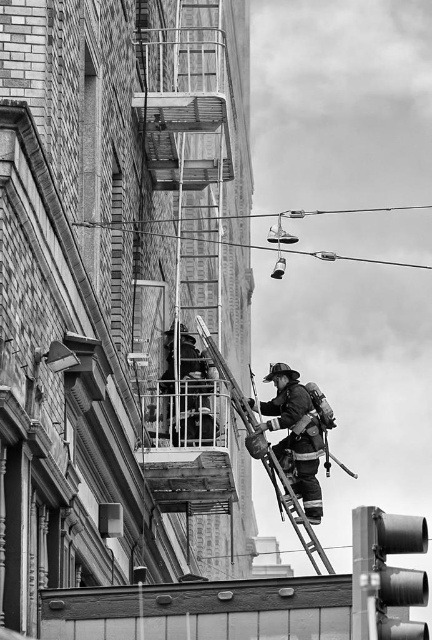
From the picture: You are a firefighter trying to reach the third floor window of the building. You have two options to climb up, the rustic metal fire escape at center and the metallic silver ladder at center. Which one would you choose and why?

You should choose the rustic metal fire escape at center because it is larger in size than the metallic silver ladder at center, making it more stable and safer for climbing to the third floor window.

You are standing at the base of the building and want to reach the point marked as point (380, 541). If your ladder can extend up to 50 meters, will it be sufficient to reach that point?

The point (380, 541) is 51.14 meters from the viewer, so the ladder that can extend up to 50 meters is not sufficient to reach that point.